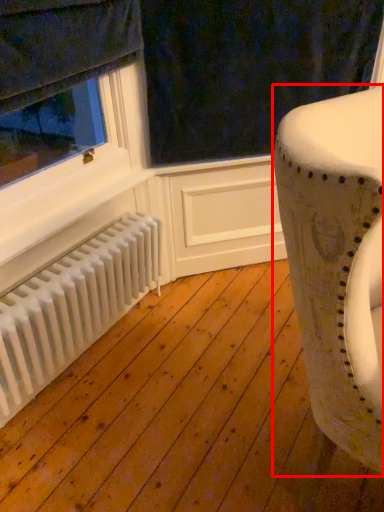
Question: From the image's perspective, what is the correct spatial positioning of furniture (annotated by the red box) in reference to radiator?

Choices:
 (A) above
 (B) below

Answer: (A)